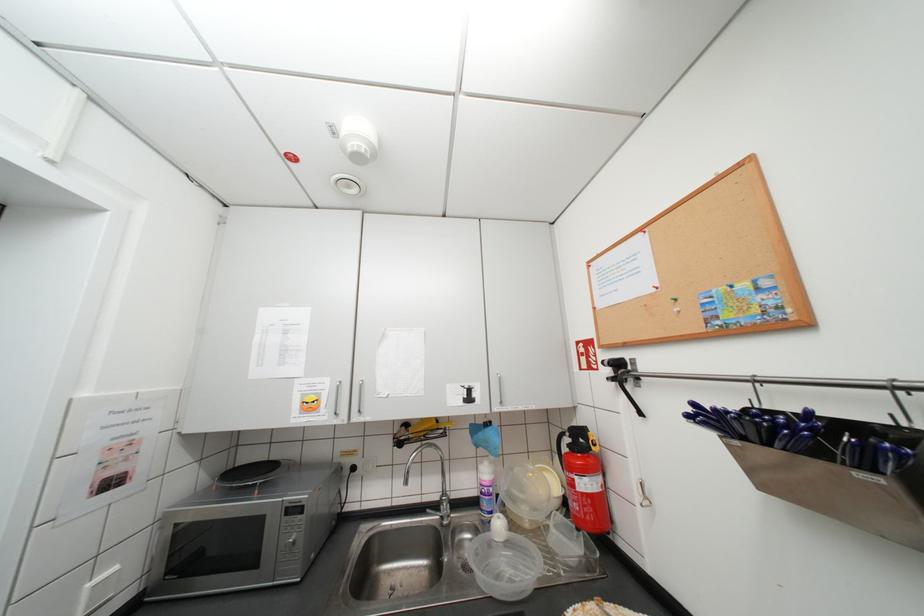
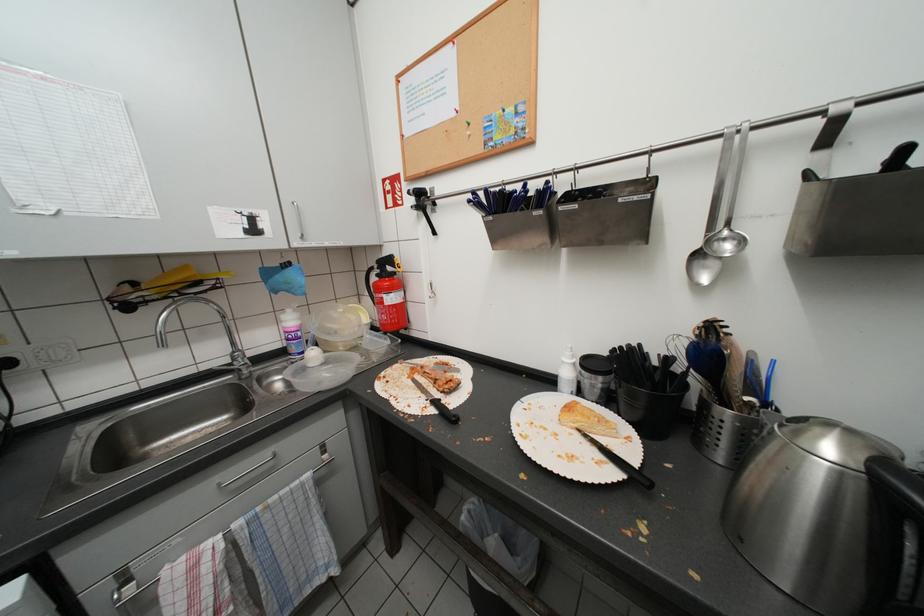
The first image is from the beginning of the video and the second image is from the end. How did the camera likely rotate when shooting the video?

The rotation direction of the camera is right-down.